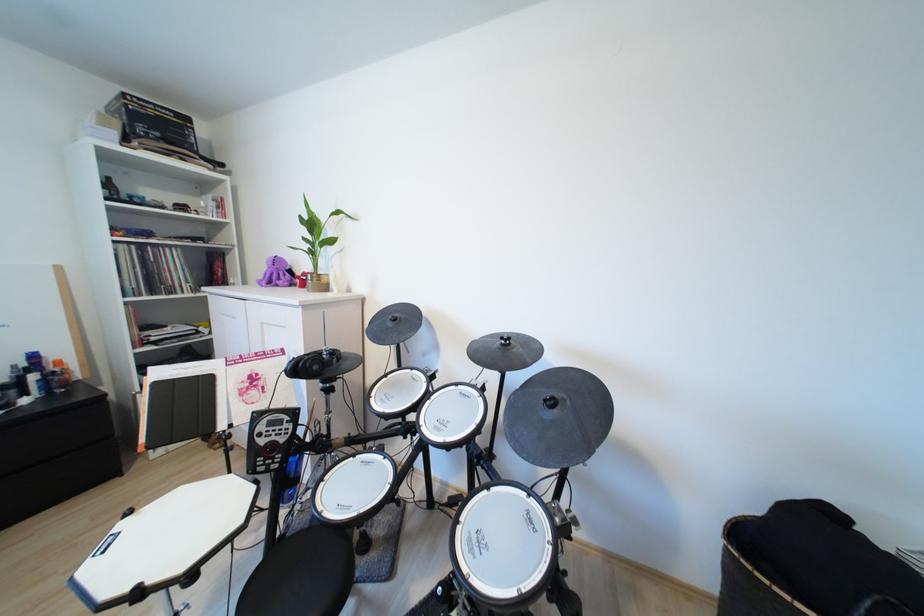
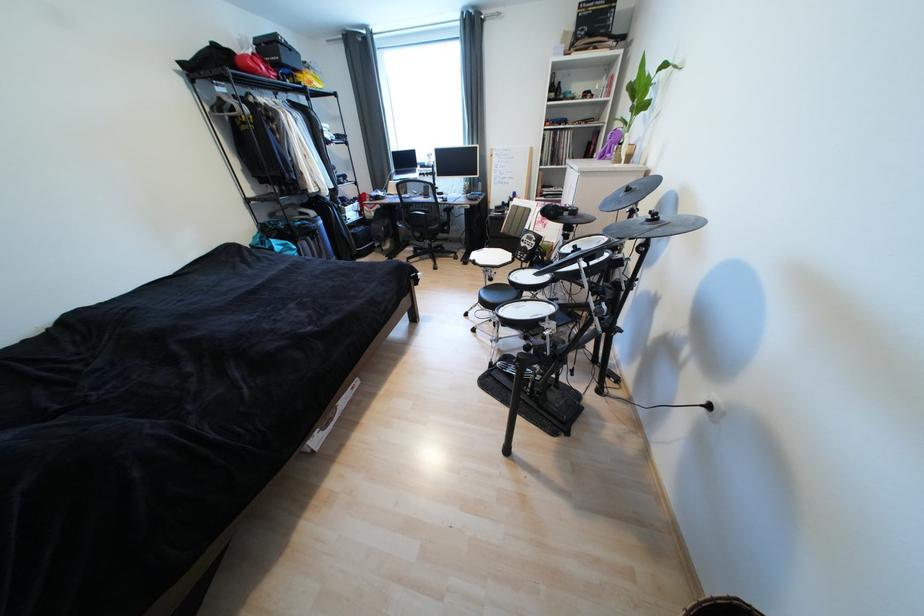
Find the pixel in the second image that matches [276,284] in the first image.

(609, 156)